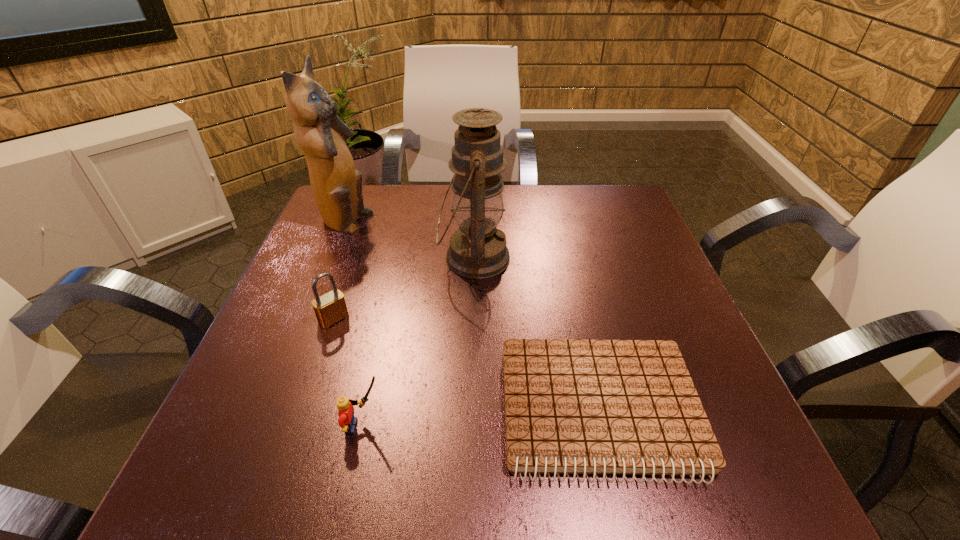
The width and height of the screenshot is (960, 540). I want to click on cat, so click(x=336, y=185).

Locate an element on the screen. Image resolution: width=960 pixels, height=540 pixels. oil lamp is located at coordinates (477, 250).

Where is `the third nearest object`? The image size is (960, 540). the third nearest object is located at coordinates (329, 308).

Find the location of a particular element. The image size is (960, 540). the third object from left to right is located at coordinates (347, 421).

Find the location of a particular element. This screenshot has height=540, width=960. notebook is located at coordinates (575, 407).

Where is `free spot located 0.380m on the face of the cat`? free spot located 0.380m on the face of the cat is located at coordinates (521, 223).

I want to click on vacant space situated 0.050m on the front of the oil lamp, so click(473, 308).

Image resolution: width=960 pixels, height=540 pixels. Find the location of `free space located on the back of the third nearest object`. free space located on the back of the third nearest object is located at coordinates (344, 288).

Find the location of a particular element. vacant area situated on the front-facing side of the third object from left to right is located at coordinates (486, 426).

You are a GUI agent. You are given a task and a screenshot of the screen. Output one action in this format:
    pyautogui.click(x=<x>, y=<y>)
    Task: Click on the vacant position located on the back of the shortest object
    
    Given the screenshot: What is the action you would take?
    pyautogui.click(x=561, y=242)